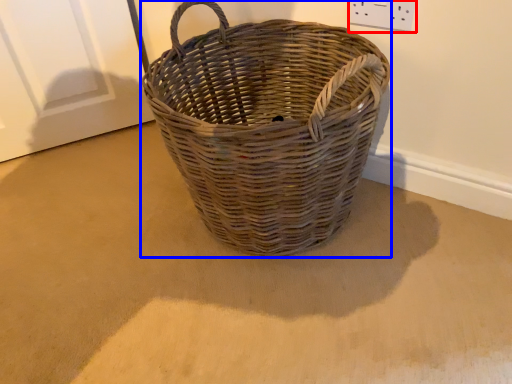
Question: Which point is further to the camera, electric outlet (highlighted by a red box) or picnic basket (highlighted by a blue box)?

Choices:
 (A) electric outlet
 (B) picnic basket

Answer: (A)